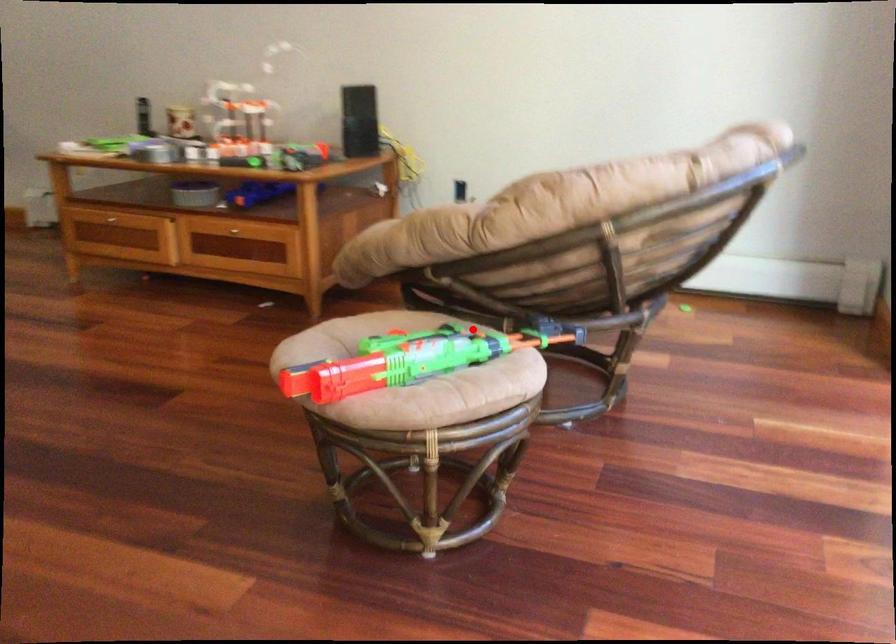
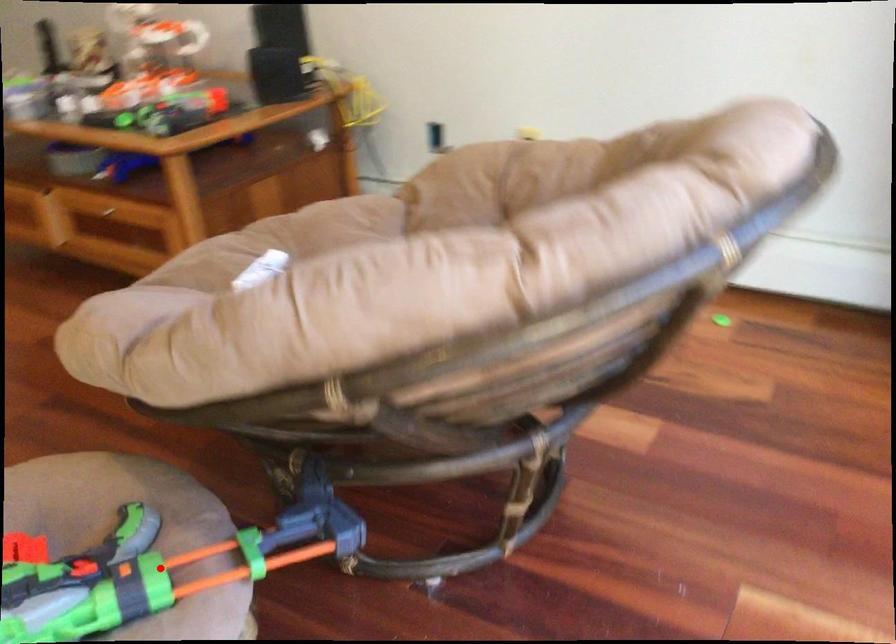
I am providing you with two images of the same scene from different viewpoints. A red point is marked on the first image and another point is marked on the second image. Does the point marked in image1 correspond to the same location as the one in image2?

No